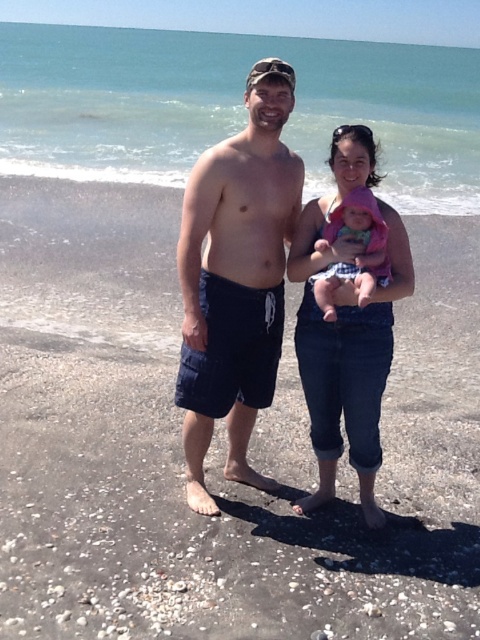
Question: Where is dark blue shorts at center located in relation to pink fabric baby at center in the image?

Choices:
 (A) right
 (B) left

Answer: (B)

Question: Which point is closer to the camera?

Choices:
 (A) (336, 216)
 (B) (279, 115)
 (C) (107, 449)
 (D) (295, 262)

Answer: (B)

Question: Which point appears closest to the camera in this image?

Choices:
 (A) (128, 358)
 (B) (377, 228)
 (C) (362, 330)
 (D) (193, 321)

Answer: (B)

Question: Does smooth sand at center appear under dark blue shorts at center?

Choices:
 (A) no
 (B) yes

Answer: (B)

Question: Is dark blue shorts at center thinner than pink fabric baby at center?

Choices:
 (A) yes
 (B) no

Answer: (B)

Question: Which object is closer to the camera taking this photo?

Choices:
 (A) dark blue shorts at center
 (B) pink fabric baby at center
 (C) smooth sand at center
 (D) denim jeans at center

Answer: (C)